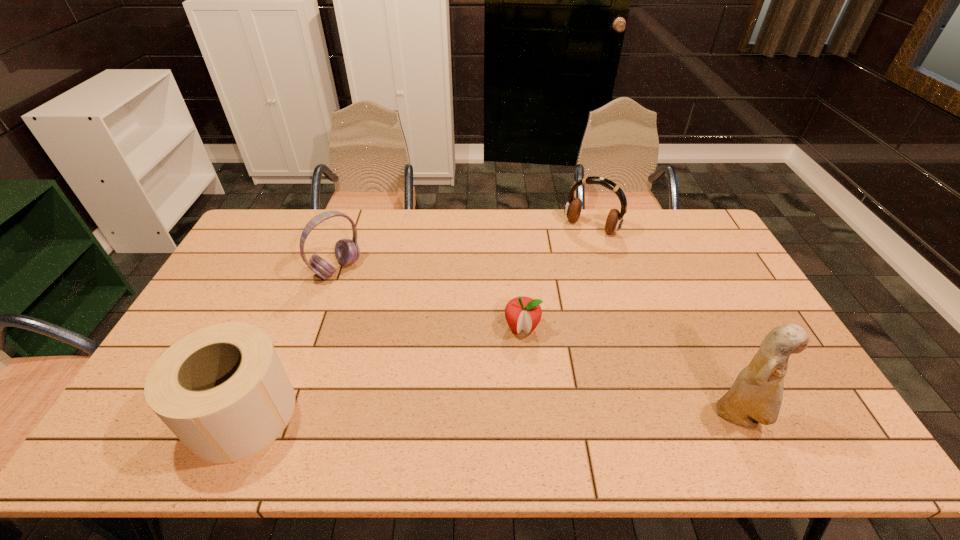
Select which object is the second closest to the tallest object. Please provide its 2D coordinates. Your answer should be formatted as a tuple, i.e. [(x, y)], where the tuple contains the x and y coordinates of a point satisfying the conditions above.

[(573, 208)]

Select which object appears as the fourth closest to the rightmost object. Please provide its 2D coordinates. Your answer should be formatted as a tuple, i.e. [(x, y)], where the tuple contains the x and y coordinates of a point satisfying the conditions above.

[(347, 251)]

This screenshot has height=540, width=960. What are the coordinates of `blank area in the image that satisfies the following two spatial constraints: 1. on the front side of the second farthest object; 2. on the front-facing side of the figurine` in the screenshot? It's located at (285, 417).

This screenshot has height=540, width=960. What are the coordinates of `free spot that satisfies the following two spatial constraints: 1. on the front side of the figurine; 2. on the front-facing side of the farther headset` in the screenshot? It's located at (649, 417).

You are a GUI agent. You are given a task and a screenshot of the screen. Output one action in this format:
    pyautogui.click(x=<x>, y=<y>)
    Task: Click on the vacant position in the image that satisfies the following two spatial constraints: 1. on the front side of the shortest object; 2. on the right side of the fourth nearest object
    
    Given the screenshot: What is the action you would take?
    pyautogui.click(x=317, y=328)

Find the location of a particular element. Image resolution: width=960 pixels, height=540 pixels. vacant point that satisfies the following two spatial constraints: 1. on the front side of the figurine; 2. on the front-facing side of the toilet tissue is located at coordinates (240, 417).